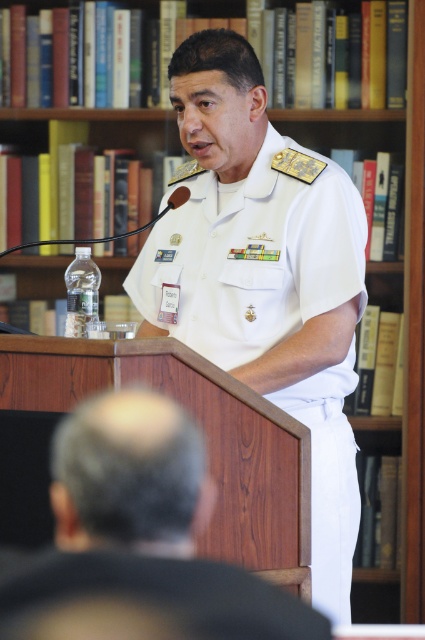
Question: Can you confirm if white cotton uniform at center is smaller than white uniform at center?

Choices:
 (A) yes
 (B) no

Answer: (B)

Question: Is white cotton uniform at center to the right of white uniform at center from the viewer's perspective?

Choices:
 (A) no
 (B) yes

Answer: (B)

Question: Among these objects, which one is farthest from the camera?

Choices:
 (A) white uniform at center
 (B) white cotton uniform at center

Answer: (B)

Question: Which of the following is the closest to the observer?

Choices:
 (A) white cotton uniform at center
 (B) white uniform at center

Answer: (B)

Question: Is white cotton uniform at center above white uniform at center?

Choices:
 (A) yes
 (B) no

Answer: (A)